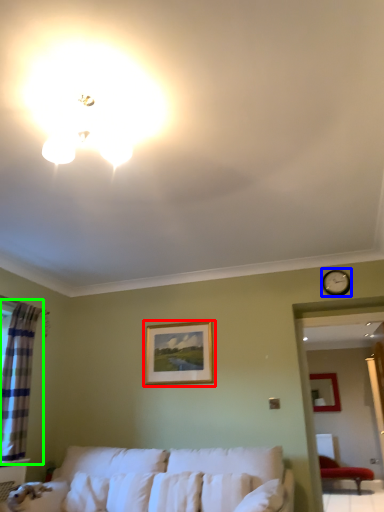
Question: Which is nearer to the picture frame (highlighted by a red box)? clock (highlighted by a blue box) or curtain (highlighted by a green box).

Choices:
 (A) clock
 (B) curtain

Answer: (B)